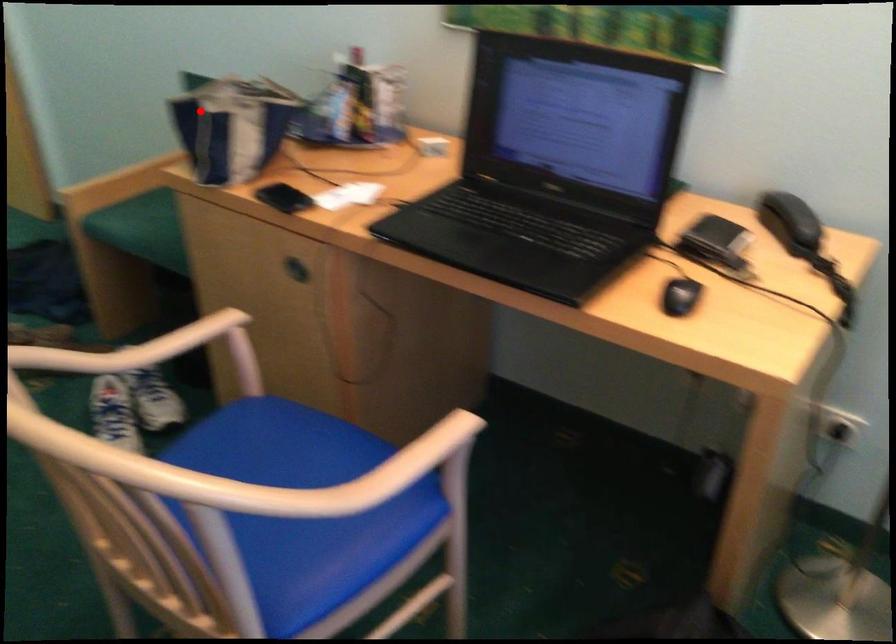
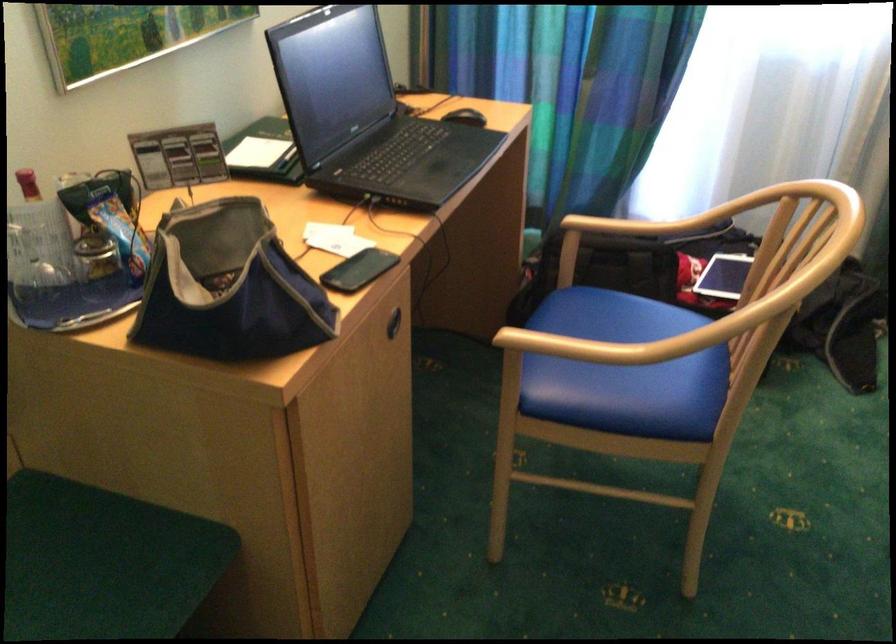
Question: I am providing you with two images of the same scene from different viewpoints. Image1 has a red point marked. In image2, the corresponding 3D location appears at what relative position? Reply with the corresponding letter.

Choices:
 (A) Closer
 (B) Farther

Answer: (A)